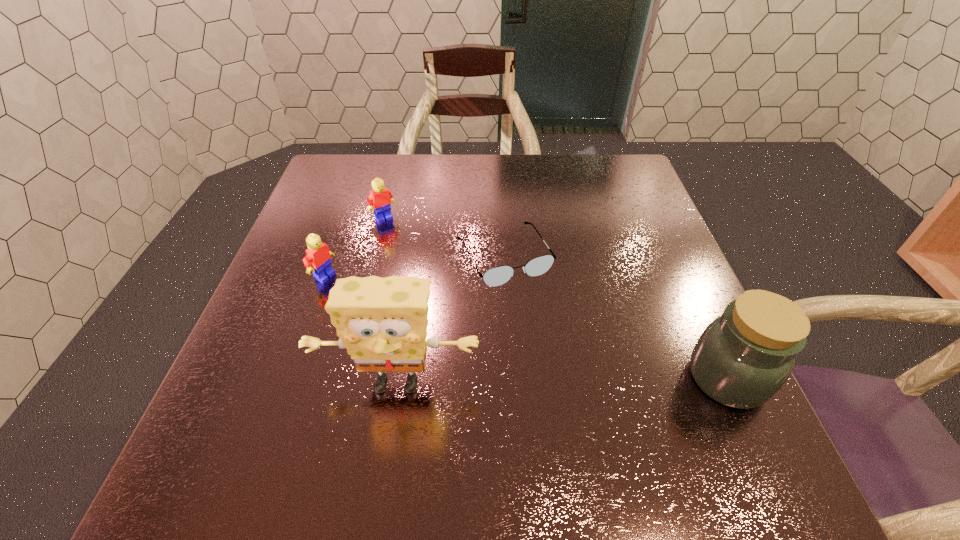
This screenshot has height=540, width=960. In order to click on free space located 0.110m on the front-facing side of the nearer Lego in this screenshot , I will do `click(371, 301)`.

You are a GUI agent. You are given a task and a screenshot of the screen. Output one action in this format:
    pyautogui.click(x=<x>, y=<y>)
    Task: Click on the vacant space positioned 0.070m on the front-facing side of the nearer Lego
    
    Given the screenshot: What is the action you would take?
    pyautogui.click(x=356, y=294)

The width and height of the screenshot is (960, 540). I want to click on vacant point located on the front-facing side of the farthest object, so click(x=441, y=286).

Where is `vacant space positioned on the front-facing side of the farthest object`? Image resolution: width=960 pixels, height=540 pixels. vacant space positioned on the front-facing side of the farthest object is located at coordinates (408, 245).

At what (x,y) coordinates should I click in order to perform the action: click on vacant space positioned on the front-facing side of the farthest object. Please return your answer as a coordinate pair (x, y). This screenshot has height=540, width=960. Looking at the image, I should click on (421, 262).

The width and height of the screenshot is (960, 540). Identify the location of vacant position located 0.340m on the lenses of the shortest object. (605, 429).

Locate an element on the screen. This screenshot has width=960, height=540. vacant region located on the lenses of the shortest object is located at coordinates (561, 353).

At what (x,y) coordinates should I click in order to perform the action: click on free spot located 0.170m on the lenses of the shortest object. Please return your answer as a coordinate pair (x, y). The image size is (960, 540). Looking at the image, I should click on (558, 349).

Find the location of a particular element. The height and width of the screenshot is (540, 960). sponge that is at the near edge is located at coordinates (382, 322).

You are a GUI agent. You are given a task and a screenshot of the screen. Output one action in this format:
    pyautogui.click(x=<x>, y=<y>)
    Task: Click on the jar at the near edge
    
    Given the screenshot: What is the action you would take?
    pyautogui.click(x=741, y=360)